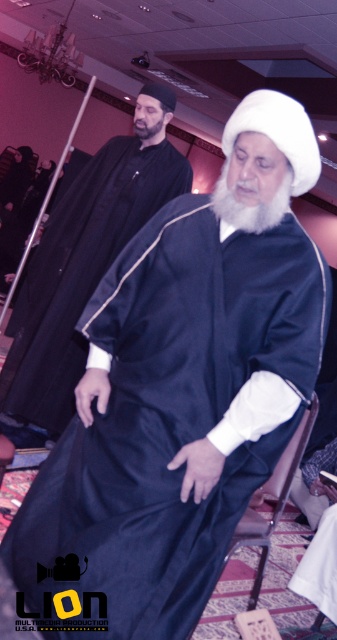
Consider the image. Based on the scene description, can you determine if the satin black robe at center is wider than the white soft beard at center?

The satin black robe at center might be wider than white soft beard at center according to the description.

You are an interior designer planning to install a new light fixture in the room. You need to ensure that the light will shine directly onto both the brown leather chair at lower center and the gray matte beard at upper center. Based on their positions, can you determine if the light will naturally illuminate both areas without needing to adjust the fixture?

The brown leather chair at lower center is positioned under the gray matte beard at upper center, so the light from above would naturally illuminate both areas without needing adjustments.

You are designing a seating arrangement for a meeting in this room. The brown leather chair at lower center needs to be placed next to the gray matte beard at upper center. Considering their sizes, which one should be placed on the side with more space?

The brown leather chair at lower center has a larger width than the gray matte beard at upper center, so the brown leather chair at lower center should be placed on the side with more space.